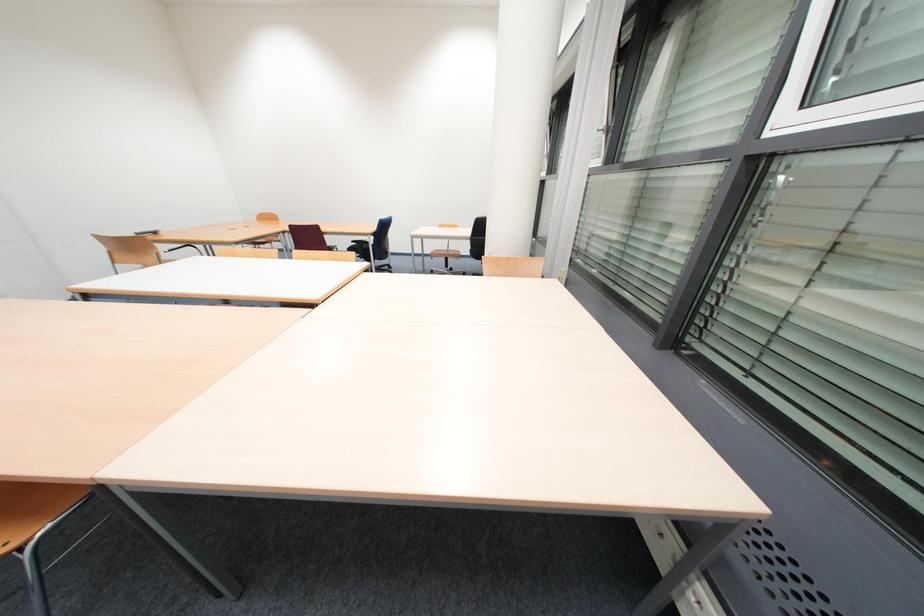
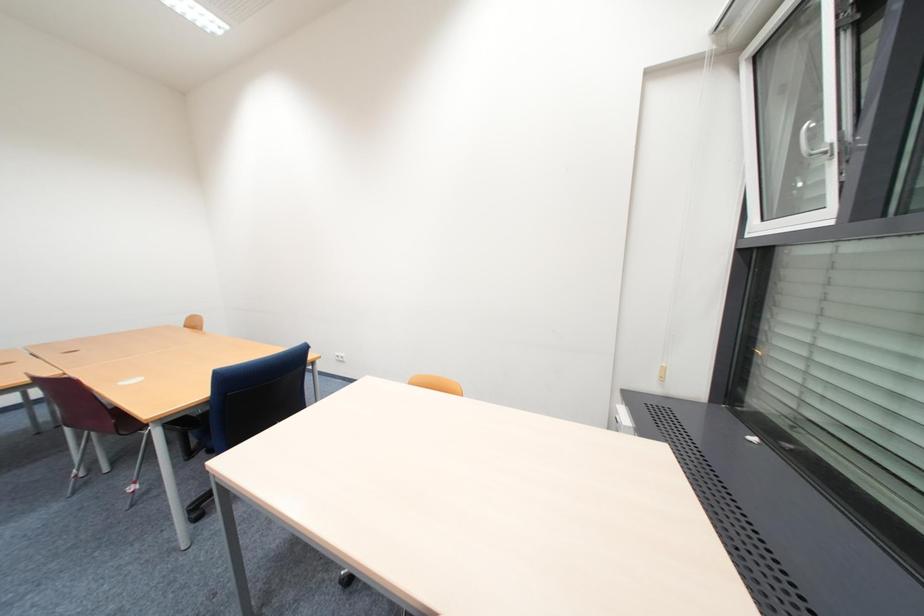
Question: In a continuous first-person perspective shot, in which direction is the camera moving?

Choices:
 (A) Left
 (B) Right
 (C) Forward
 (D) Backward

Answer: (C)